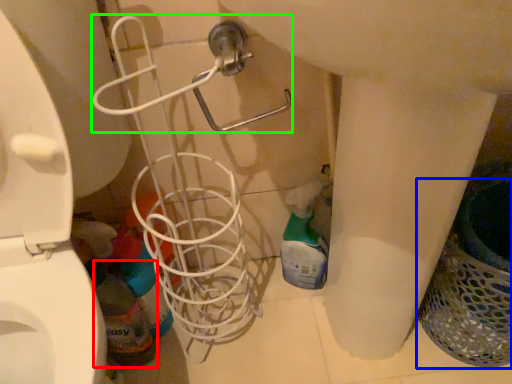
Question: Which object is positioned farthest from bottle (highlighted by a red box)? Select from laundry basket (highlighted by a blue box) and shower (highlighted by a green box).

Choices:
 (A) laundry basket
 (B) shower

Answer: (A)